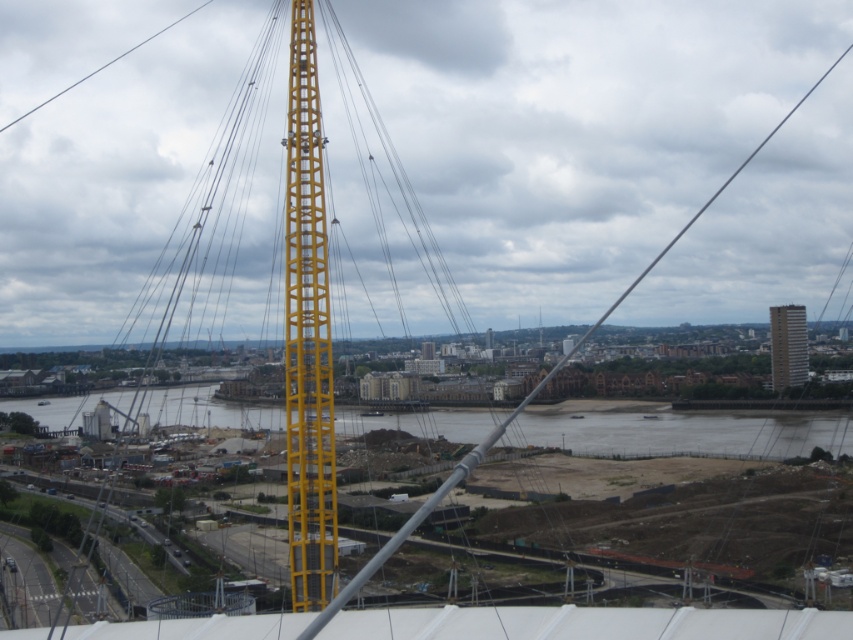
Is brown sand at lower center bigger than gray concrete building at right?

Yes.

Does brown sand at lower center have a lesser width compared to gray concrete building at right?

Incorrect, brown sand at lower center's width is not less than gray concrete building at right's.

The image size is (853, 640). Find the location of `brown sand at lower center`. brown sand at lower center is located at coordinates (677, 429).

Is point (245, 621) positioned before point (776, 310)?

That is True.

What do you see at coordinates (585, 621) in the screenshot?
I see `matte yellow crane at center` at bounding box center [585, 621].

Where is `matte yellow crane at center`? This screenshot has height=640, width=853. matte yellow crane at center is located at coordinates (585, 621).

Between yellow metallic tower at center and gray concrete building at right, which one is positioned lower?

gray concrete building at right is lower down.

Does yellow metallic tower at center appear on the right side of gray concrete building at right?

No, yellow metallic tower at center is not to the right of gray concrete building at right.

Which is in front, point (288, 188) or point (791, 353)?

Point (288, 188) is more forward.

Locate an element on the screen. yellow metallic tower at center is located at coordinates (306, 333).